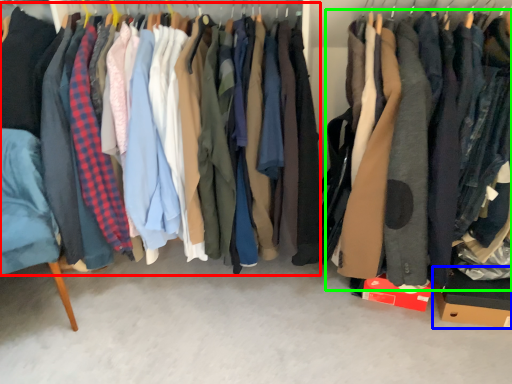
Question: Estimate the real-world distances between objects in this image. Which object is closer to closet (highlighted by a red box), cardboard box (highlighted by a blue box) or clothing (highlighted by a green box)?

Choices:
 (A) cardboard box
 (B) clothing

Answer: (B)